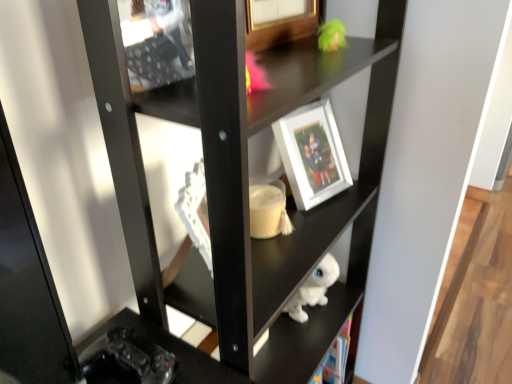
Question: Considering the relative sizes of white glossy statue at lower center and white matte picture frame at center in the image provided, is white glossy statue at lower center taller than white matte picture frame at center?

Choices:
 (A) no
 (B) yes

Answer: (B)

Question: From a real-world perspective, is white glossy statue at lower center positioned over white matte picture frame at center based on gravity?

Choices:
 (A) yes
 (B) no

Answer: (B)

Question: Can you confirm if white glossy statue at lower center is thinner than white matte picture frame at center?

Choices:
 (A) yes
 (B) no

Answer: (B)

Question: Does white glossy statue at lower center have a smaller size compared to white matte picture frame at center?

Choices:
 (A) no
 (B) yes

Answer: (A)

Question: Considering the relative positions of white glossy statue at lower center and white matte picture frame at center in the image provided, is white glossy statue at lower center behind white matte picture frame at center?

Choices:
 (A) yes
 (B) no

Answer: (B)

Question: Does white glossy statue at lower center appear on the right side of white matte picture frame at center?

Choices:
 (A) yes
 (B) no

Answer: (B)

Question: Is white matte picture frame at center in front of white glossy statue at lower center?

Choices:
 (A) yes
 (B) no

Answer: (B)

Question: Is white matte picture frame at center directly adjacent to white glossy statue at lower center?

Choices:
 (A) yes
 (B) no

Answer: (B)

Question: Does white matte picture frame at center appear on the left side of white glossy statue at lower center?

Choices:
 (A) no
 (B) yes

Answer: (A)

Question: Is white glossy statue at lower center a part of white matte picture frame at center?

Choices:
 (A) no
 (B) yes

Answer: (A)

Question: Is white matte picture frame at center not inside white glossy statue at lower center?

Choices:
 (A) yes
 (B) no

Answer: (B)

Question: Is white matte picture frame at center oriented away from white glossy statue at lower center?

Choices:
 (A) no
 (B) yes

Answer: (B)

Question: From the image's perspective, is white matte picture frame at center above or below white glossy statue at lower center?

Choices:
 (A) above
 (B) below

Answer: (A)